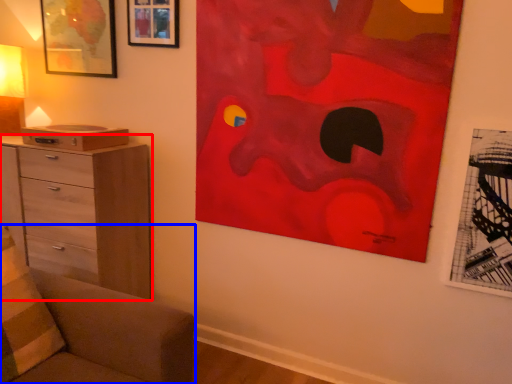
Question: Among these objects, which one is farthest to the camera, chest of drawers (highlighted by a red box) or furniture (highlighted by a blue box)?

Choices:
 (A) chest of drawers
 (B) furniture

Answer: (A)